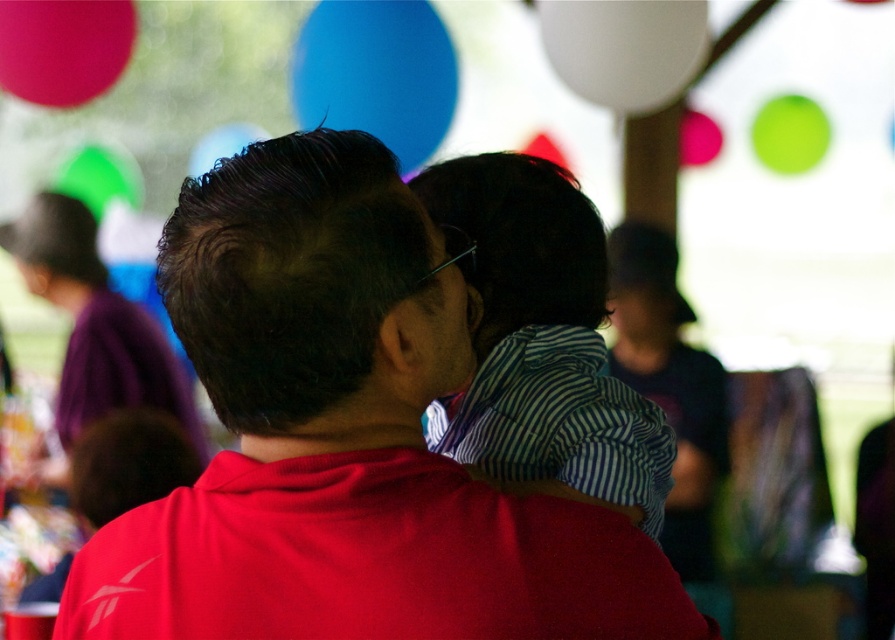
You are at a party and want to find the blue glossy balloon at upper center. According to the scene, where should you look?

The blue glossy balloon at upper center is located at point [377,74], so you should look towards the upper center area of the scene.

You are a photographer at the event and want to capture a clear shot of the striped fabric shirt at center and the purple fabric at upper left. Which object will appear larger in your photo?

The striped fabric shirt at center will appear larger in the photo because it is closer to the viewer than the purple fabric at upper left.

You are a photographer at the event and need to adjust your camera to focus on the striped fabric shirt at center and the purple fabric at upper left. Which object should you focus on first if you want to capture both in a single shot without changing the focal length?

The striped fabric shirt at center is not as tall as the purple fabric at upper left, so you should focus on the purple fabric at upper left first because it is taller and might require more attention in the frame.